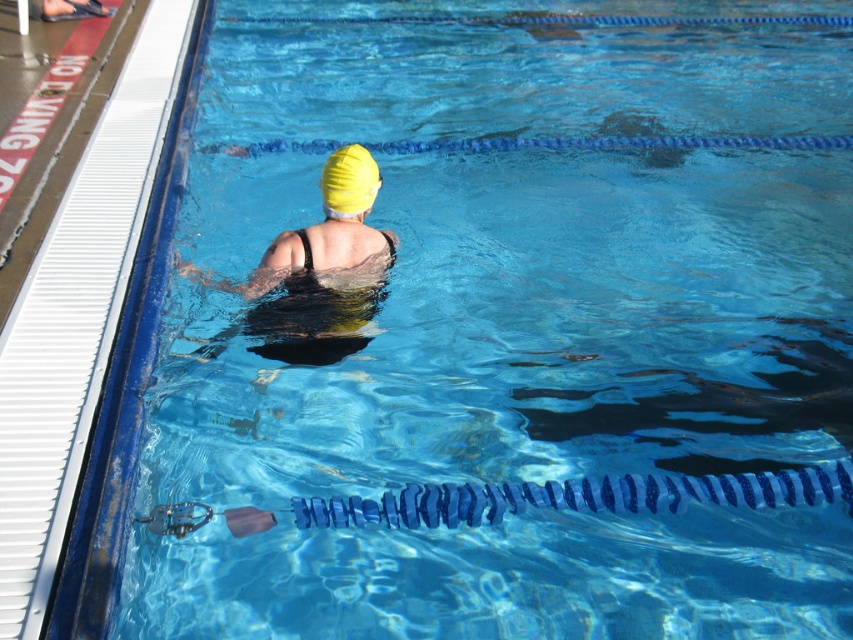
Can you confirm if yellow matte swim cap at center is shorter than transparent plastic goggles at lower center?

No.

From the picture: Who is more distant from viewer, (312, 288) or (166, 531)?

The point (312, 288) is behind.

Where is `yellow matte swim cap at center`? Image resolution: width=853 pixels, height=640 pixels. yellow matte swim cap at center is located at coordinates (320, 272).

Consider the image. How distant is yellow matte swim cap at center from yellow matte swim cap at upper center?

They are 10.87 inches apart.

What do you see at coordinates (320, 272) in the screenshot?
I see `yellow matte swim cap at center` at bounding box center [320, 272].

I want to click on yellow matte swim cap at center, so click(320, 272).

Between point (329, 154) and point (172, 529), which one is positioned behind?

The point (329, 154) is more distant.

Does yellow matte swim cap at upper center appear on the left side of transparent plastic goggles at lower center?

No, yellow matte swim cap at upper center is not to the left of transparent plastic goggles at lower center.

Who is more distant from viewer, (341, 156) or (190, 531)?

Point (341, 156)

You are a GUI agent. You are given a task and a screenshot of the screen. Output one action in this format:
    pyautogui.click(x=<x>, y=<y>)
    Task: Click on the yellow matte swim cap at upper center
    
    Given the screenshot: What is the action you would take?
    pyautogui.click(x=347, y=180)